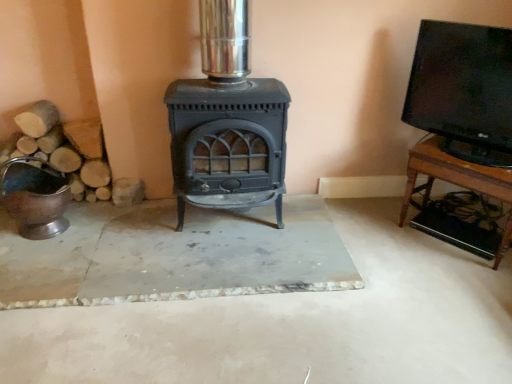
Find the location of a particular element. The width and height of the screenshot is (512, 384). unoccupied region to the right of shiny metallic bucket at left is located at coordinates point(114,231).